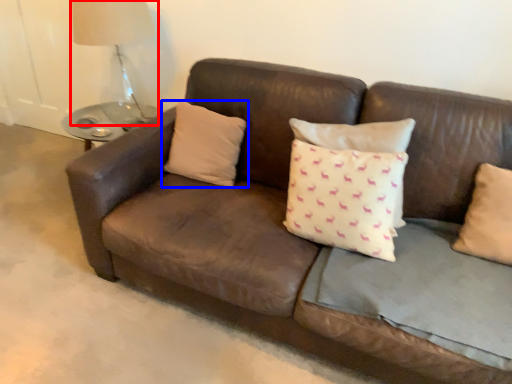
Question: Which object is closer to the camera taking this photo, table lamp (highlighted by a red box) or pillow (highlighted by a blue box)?

Choices:
 (A) table lamp
 (B) pillow

Answer: (B)